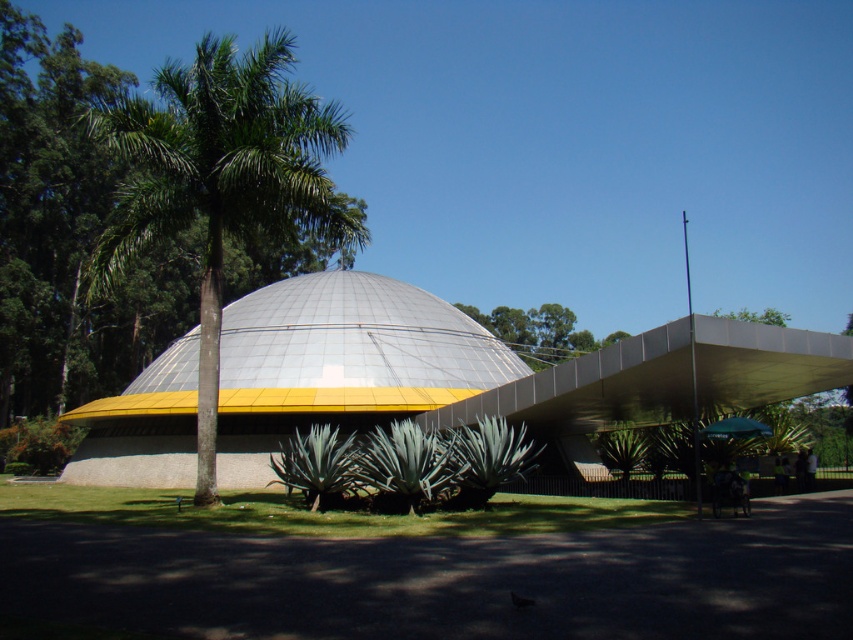
You are planning to install a new lighting fixture between the green leafy palm tree at center and the metallic dome at center. Based on their widths, which object should the fixture be placed closer to for stability?

The green leafy palm tree at center might be wider than the metallic dome at center, so the lighting fixture should be placed closer to the green leafy palm tree at center to ensure stability.

You are a landscape architect designing a new garden. You need to place a large statue that requires 3 meters of space. Given the scene, can the area between the metallic dome at center and the green leafy tree at upper center accommodate the statue?

The metallic dome at center has a lesser width compared to green leafy tree at upper center. However, the exact distance between them isn

You are standing in front of the architectural structure and want to take a photo that captures the entire metallic dome at center. If your camera has a maximum zoom range of 10 meters, will you need to move closer or farther away to ensure the dome fits entirely in the frame?

The metallic dome at center is 23.28 meters away from the camera. Since your camera can only zoom up to 10 meters, you need to move closer to the dome to ensure it fits entirely in the frame.